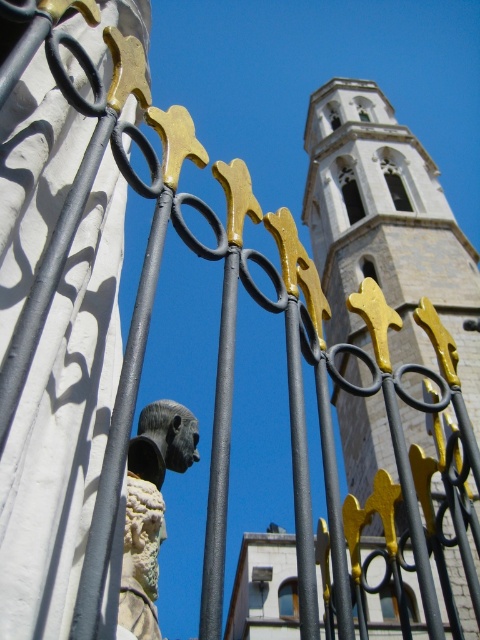
Between stone tower at upper center and white stone bust at center, which one appears on the left side from the viewer's perspective?

From the viewer's perspective, white stone bust at center appears more on the left side.

Measure the distance between stone tower at upper center and camera.

stone tower at upper center is 179.17 feet away from camera.

Find the location of a particular element. The image size is (480, 640). stone tower at upper center is located at coordinates (385, 227).